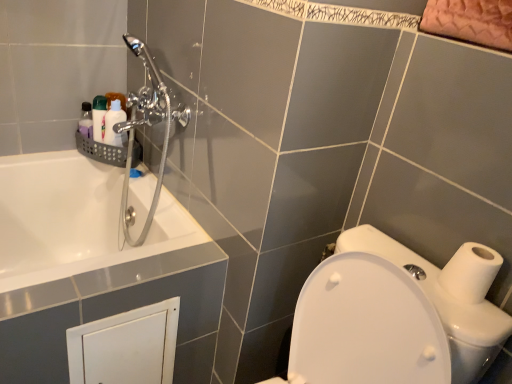
Question: Based on their sizes in the image, would you say translucent plastic soap at upper left, the first toiletry positioned from the left, is bigger or smaller than white glossy toilet at lower right?

Choices:
 (A) big
 (B) small

Answer: (B)

Question: Is translucent plastic soap at upper left, the first toiletry positioned from the left, inside or outside of white glossy toilet at lower right?

Choices:
 (A) outside
 (B) inside

Answer: (A)

Question: Considering the real-world distances, which object is closest to the white glossy toilet at lower right?

Choices:
 (A) white glossy bottle at upper left, which appears as the second toiletry when viewed from the left
 (B) white matte toilet paper at right
 (C) chrome metallic shower head at upper left
 (D) translucent plastic soap at upper left, the second toiletry viewed from the right

Answer: (B)

Question: Which object is the closest to the white glossy toilet at lower right?

Choices:
 (A) white matte toilet paper at right
 (B) translucent plastic soap at upper left, the first toiletry positioned from the left
 (C) white glossy bottle at upper left, which appears as the second toiletry when viewed from the left
 (D) chrome metallic shower head at upper left

Answer: (A)